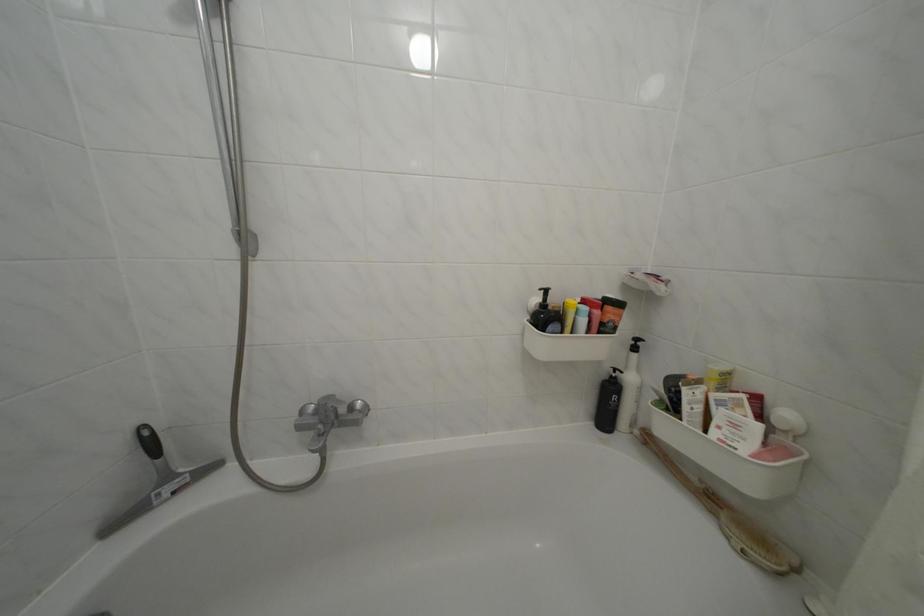
Where is `yellow plastic bottle`? The height and width of the screenshot is (616, 924). yellow plastic bottle is located at coordinates (568, 314).